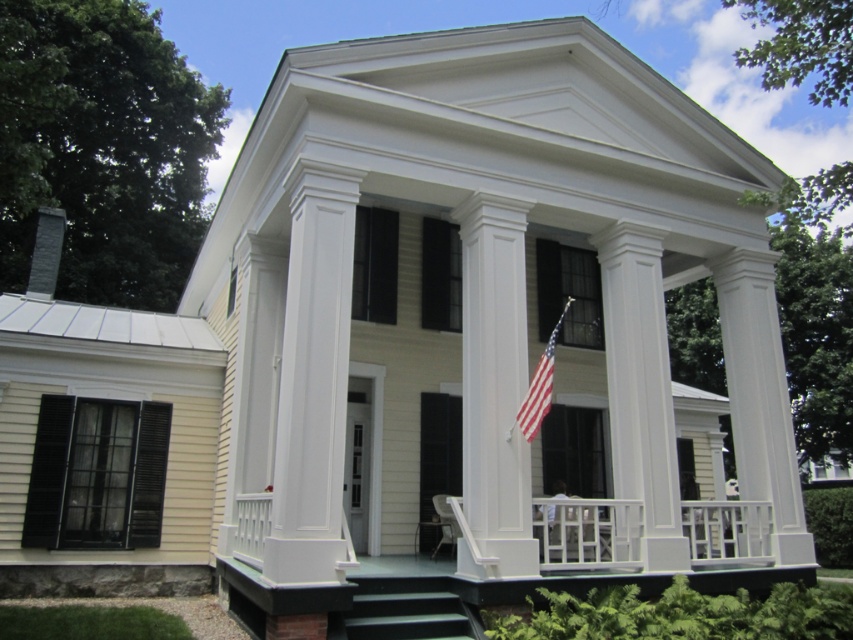
You are standing on the front lawn of the house and want to take a photo of the white glossy column at center and the dark green concrete stairs at lower center. Which object appears taller in the photo?

The white glossy column at center appears taller in the photo because it has a greater height compared to the dark green concrete stairs at lower center.